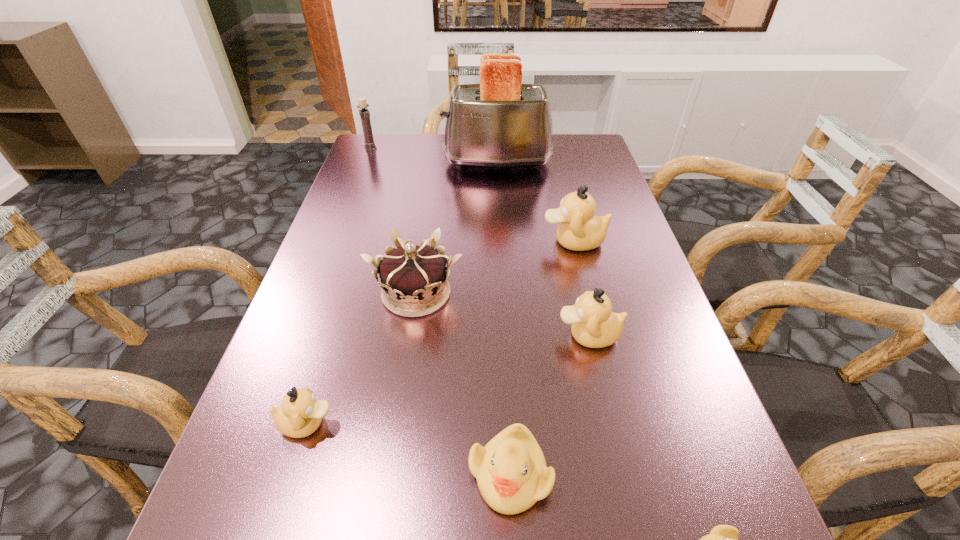
Where is `vacant area that lies between the tallest object and the left yellow duckling`? This screenshot has width=960, height=540. vacant area that lies between the tallest object and the left yellow duckling is located at coordinates pyautogui.click(x=504, y=318).

Locate an element on the screen. This screenshot has width=960, height=540. free space between the smallest tan duckling and the crown is located at coordinates (362, 359).

Identify the location of unoccupied area between the fourth shortest duckling and the toaster. Image resolution: width=960 pixels, height=540 pixels. (542, 249).

Where is `vacant point located between the tallest object and the fourth nearest duckling`? vacant point located between the tallest object and the fourth nearest duckling is located at coordinates click(x=542, y=249).

The width and height of the screenshot is (960, 540). What are the coordinates of `free space between the second tallest duckling and the left yellow duckling` in the screenshot? It's located at (549, 405).

Locate which object is the second closest to the gold crown. Please provide its 2D coordinates. Your answer should be formatted as a tuple, i.e. [(x, y)], where the tuple contains the x and y coordinates of a point satisfying the conditions above.

[(594, 325)]

Identify which object is the seventh nearest to the toaster. Please provide its 2D coordinates. Your answer should be formatted as a tuple, i.e. [(x, y)], where the tuple contains the x and y coordinates of a point satisfying the conditions above.

[(723, 539)]

Locate which duckling is the third closest to the second farthest tan duckling. Please provide its 2D coordinates. Your answer should be formatted as a tuple, i.e. [(x, y)], where the tuple contains the x and y coordinates of a point satisfying the conditions above.

[(723, 539)]

Identify which duckling is located as the fourth nearest to the smallest tan duckling. Please provide its 2D coordinates. Your answer should be formatted as a tuple, i.e. [(x, y)], where the tuple contains the x and y coordinates of a point satisfying the conditions above.

[(579, 230)]

The width and height of the screenshot is (960, 540). Find the location of `tan duckling that stands as the second closest to the farther yellow duckling`. tan duckling that stands as the second closest to the farther yellow duckling is located at coordinates (300, 415).